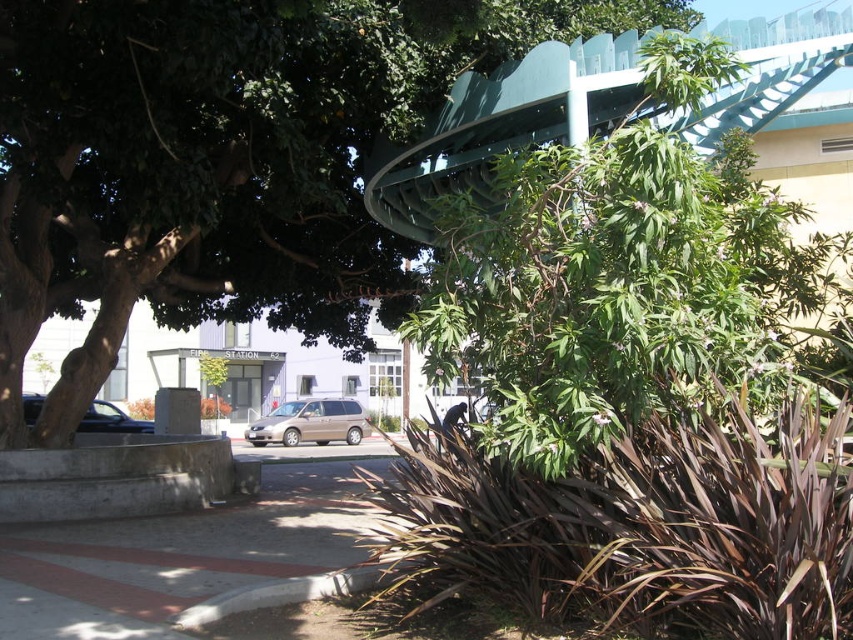
You are a pedestrian standing on the pathway and want to cross to the other side. The green leafy tree at upper center and the shiny black sedan at left are in your path. Which object is bigger and might block your view more?

The green leafy tree at upper center is larger in size than the shiny black sedan at left, so it might block your view more.

You are a pedestrian standing on the pathway and want to walk to the shiny black sedan at left. Which direction should you go relative to the green leafy tree at upper center?

The green leafy tree at upper center is to the right of the shiny black sedan at left. To reach the shiny black sedan at left, you should walk to the left of the green leafy tree at upper center.